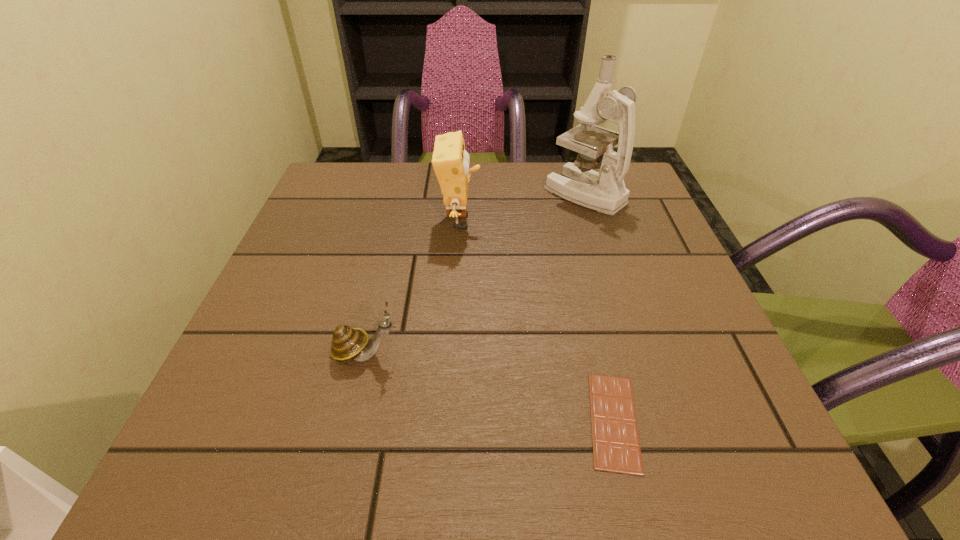
Identify the location of vacant space at the right edge of the desktop. This screenshot has width=960, height=540. (635, 282).

Image resolution: width=960 pixels, height=540 pixels. In the image, there is a desktop. In order to click on free region at the far left corner in this screenshot , I will do `click(378, 187)`.

The width and height of the screenshot is (960, 540). Identify the location of vacant space at the near right corner of the desktop. (720, 481).

In order to click on free space between the tallest object and the third farthest object in this screenshot , I will do `click(475, 274)`.

The height and width of the screenshot is (540, 960). I want to click on free point between the leftmost object and the third shortest object, so click(413, 288).

You are a GUI agent. You are given a task and a screenshot of the screen. Output one action in this format:
    pyautogui.click(x=<x>, y=<y>)
    Task: Click on the empty location between the second shortest object and the sponge
    The width and height of the screenshot is (960, 540).
    Given the screenshot: What is the action you would take?
    pyautogui.click(x=413, y=288)

Image resolution: width=960 pixels, height=540 pixels. What are the coordinates of `vacant space that's between the second nearest object and the tallest object` in the screenshot? It's located at (475, 274).

Where is `free space between the second shortest object and the nearest object`? free space between the second shortest object and the nearest object is located at coordinates (490, 387).

This screenshot has height=540, width=960. I want to click on free space between the snail and the second object from left to right, so click(x=413, y=288).

The height and width of the screenshot is (540, 960). In order to click on blank region between the third tallest object and the shortest object in this screenshot , I will do `click(490, 387)`.